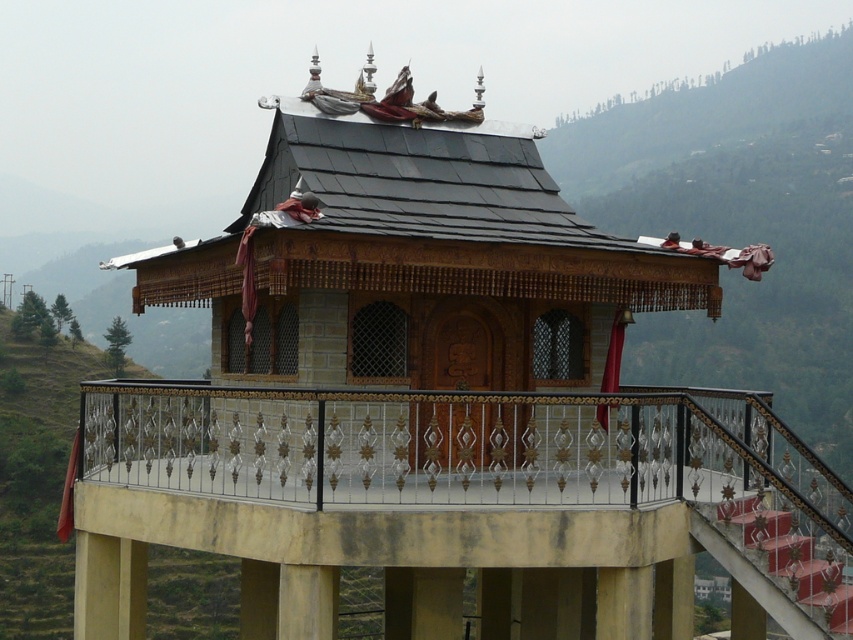
Is point (204, 502) in front of point (351, 180)?

Yes, point (204, 502) is closer to viewer.

What do you see at coordinates (460, 508) in the screenshot? This screenshot has width=853, height=640. I see `metallic wrought iron balcony at center` at bounding box center [460, 508].

Locate an element on the screen. metallic wrought iron balcony at center is located at coordinates (460, 508).